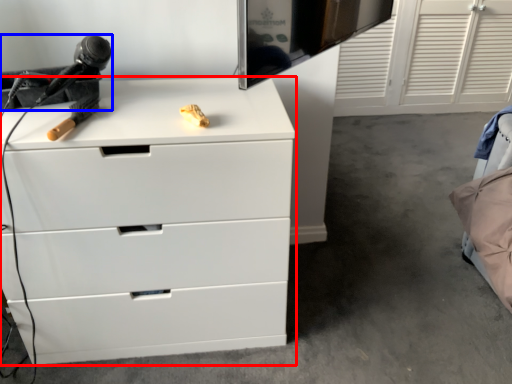
Question: Which object is closer to the camera taking this photo, chest of drawers (highlighted by a red box) or equipment (highlighted by a blue box)?

Choices:
 (A) chest of drawers
 (B) equipment

Answer: (A)